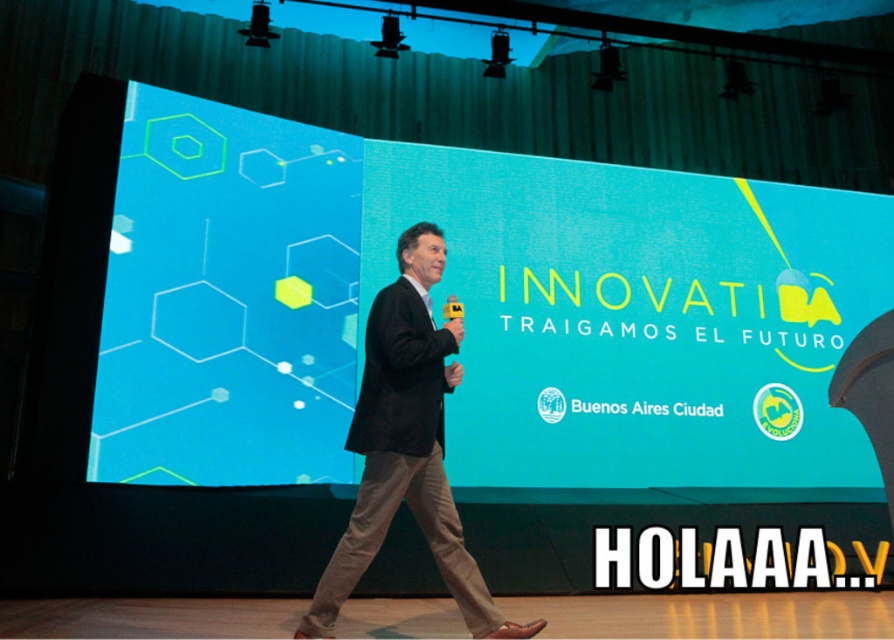
Question: Which is farther from the blue matte projection screen at center?

Choices:
 (A) black suit at center
 (B) blue glossy hexagons at upper left

Answer: (A)

Question: Does blue glossy hexagons at upper left appear on the right side of black suit at center?

Choices:
 (A) no
 (B) yes

Answer: (A)

Question: In this image, where is blue matte projection screen at center located relative to black suit at center?

Choices:
 (A) below
 (B) above

Answer: (B)

Question: Which point is closer to the camera?

Choices:
 (A) (549, 416)
 (B) (417, 419)

Answer: (B)

Question: Can you confirm if blue matte projection screen at center is bigger than blue glossy hexagons at upper left?

Choices:
 (A) no
 (B) yes

Answer: (B)

Question: Which of these objects is positioned closest to the blue glossy hexagons at upper left?

Choices:
 (A) blue matte projection screen at center
 (B) black suit at center

Answer: (A)